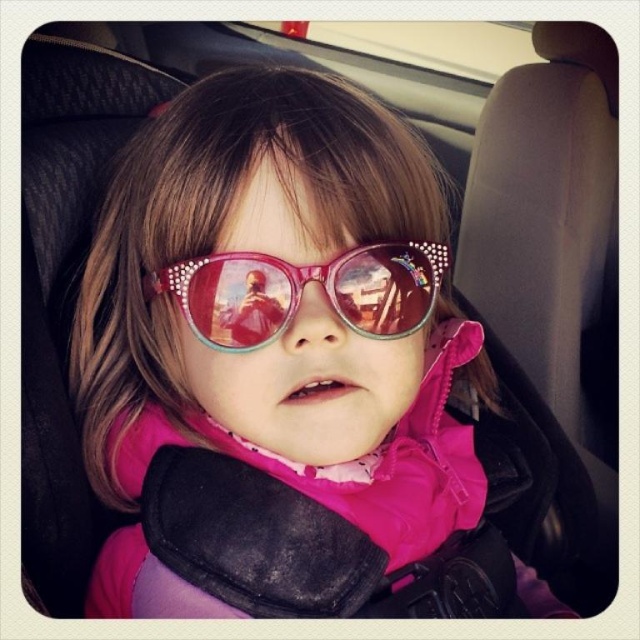
You are a safety inspector checking the car seat accessories. You see the pink glossy sunglasses at center and the translucent pink plastic goggles at center. Which accessory is bigger in size?

The pink glossy sunglasses at center has a larger size compared to the translucent pink plastic goggles at center, so the pink glossy sunglasses at center is bigger.

You are a safety inspector examining the car seat. You notice two items on the child, the pink glossy sunglasses at center and the translucent pink plastic goggles at center. Which item is taller?

The pink glossy sunglasses at center is much taller than the translucent pink plastic goggles at center.

Consider the image. You are a photographer taking a picture of the car interior. You notice two points in the image at coordinates point (x=308, y=180) and point (x=232, y=324). Which point will appear larger in your photo?

Point (x=308, y=180) is closer to the camera than point (x=232, y=324), so it will appear larger in the photo.